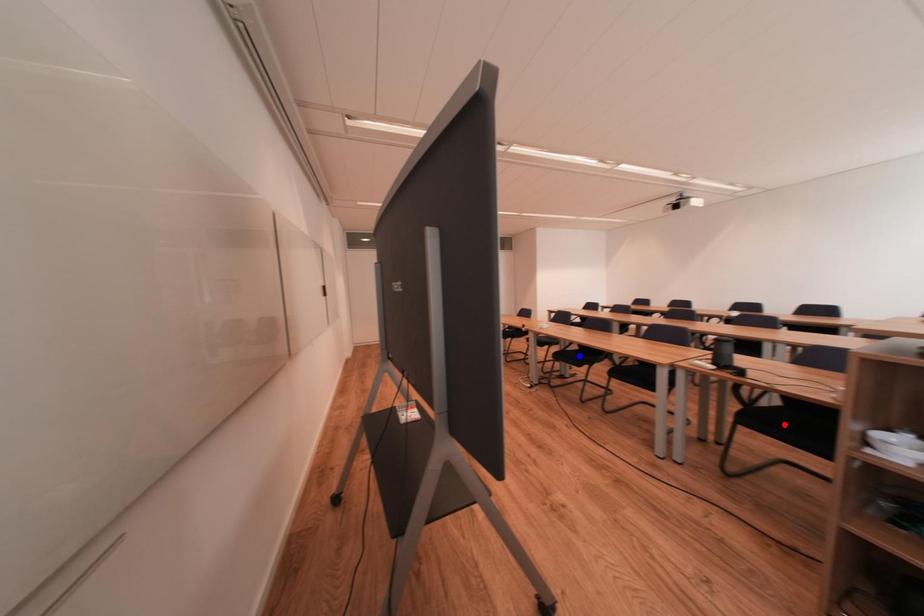
Question: Two points are marked on the image. Which point is closer to the camera?

Choices:
 (A) Blue point is closer.
 (B) Red point is closer.

Answer: (B)